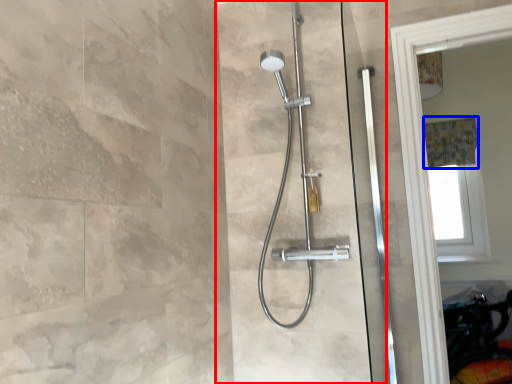
Question: Which point is further to the camera, screen door (highlighted by a red box) or shower curtain (highlighted by a blue box)?

Choices:
 (A) screen door
 (B) shower curtain

Answer: (B)